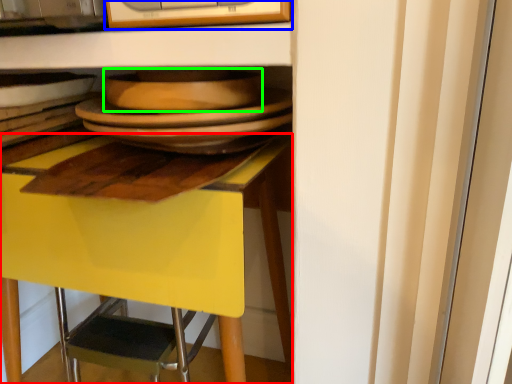
Question: Estimate the real-world distances between objects in this image. Which object is farther from desk (highlighted by a red box), appliance (highlighted by a blue box) or platter (highlighted by a green box)?

Choices:
 (A) appliance
 (B) platter

Answer: (A)